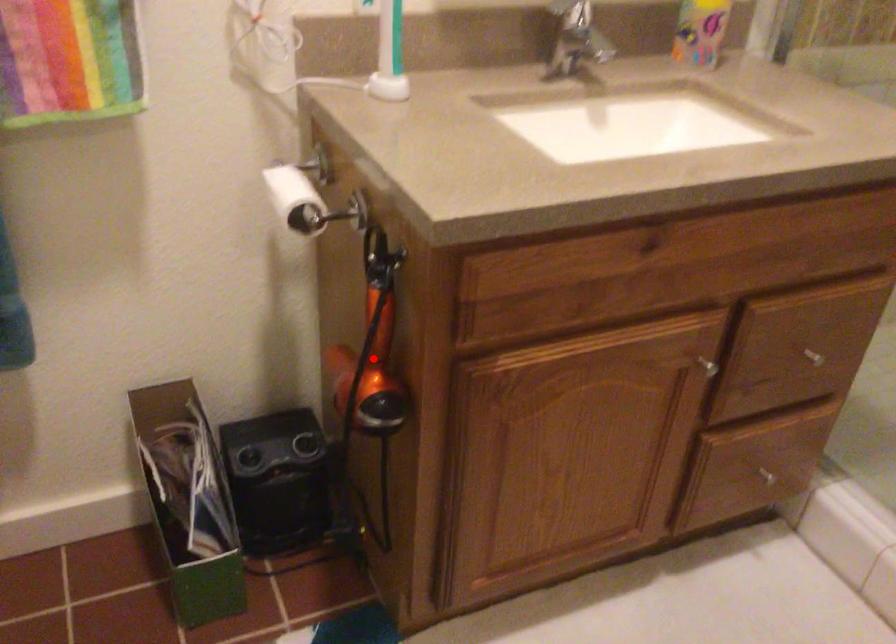
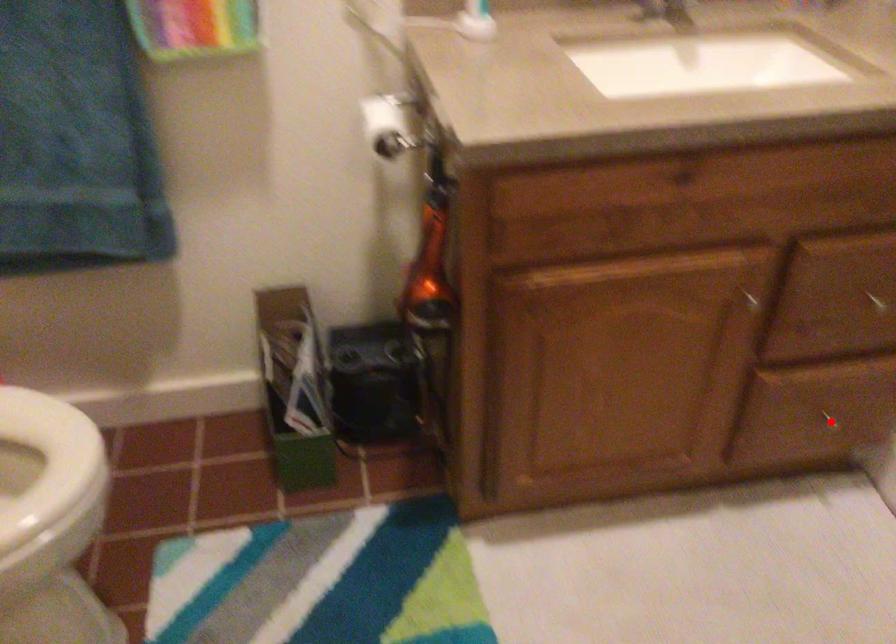
I am providing you with two images of the same scene from different viewpoints. A red point is marked on the first image and another point is marked on the second image. Does the point marked in image1 correspond to the same location as the one in image2?

No